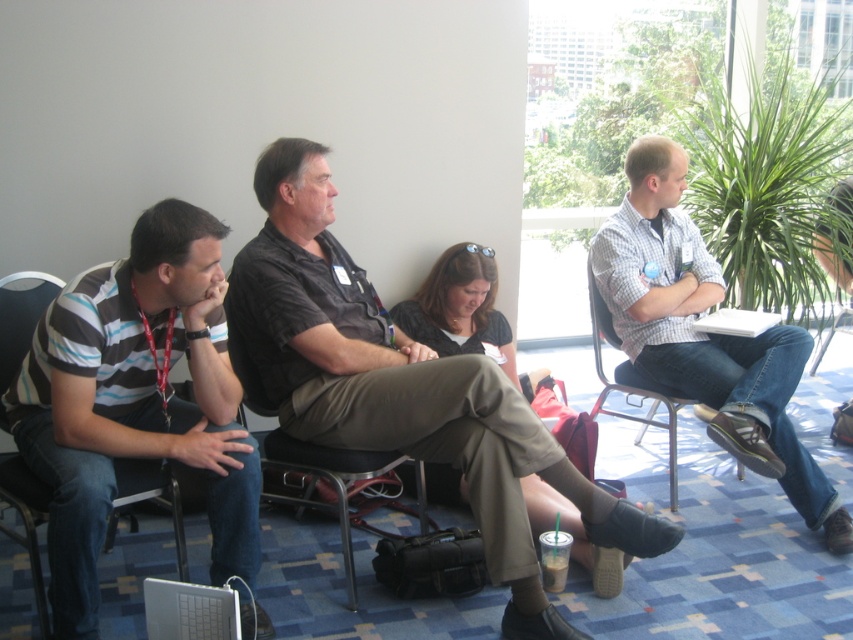
Question: Which of the following is the closest to the observer?

Choices:
 (A) (593, 333)
 (B) (157, 628)

Answer: (B)

Question: Is striped cotton shirt at left above white matte laptop at right?

Choices:
 (A) yes
 (B) no

Answer: (B)

Question: Can you confirm if dark brown shirt at center is wider than checkered shirt at right?

Choices:
 (A) no
 (B) yes

Answer: (B)

Question: Can you confirm if dark brown shirt at center is positioned to the left of striped cotton shirt at left?

Choices:
 (A) yes
 (B) no

Answer: (B)

Question: Which point is closer to the camera taking this photo?

Choices:
 (A) (218, 618)
 (B) (811, 470)
 (C) (152, 442)

Answer: (A)

Question: Which object appears closest to the camera in this image?

Choices:
 (A) dark brown shirt at center
 (B) black fabric chair at center
 (C) metallic silver chair at right
 (D) white matte laptop at right

Answer: (A)